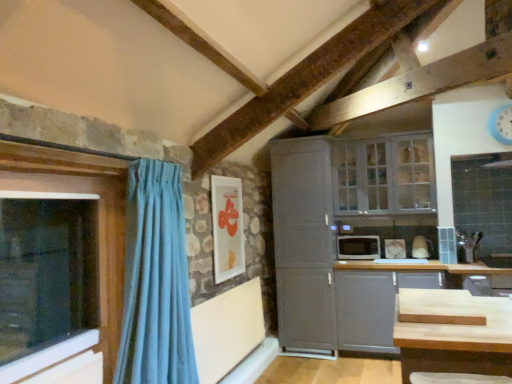
This screenshot has height=384, width=512. Identify the location of white glossy microwave at center-right. (358, 247).

The image size is (512, 384). What are the coordinates of `light blue fabric curtain at left` in the screenshot? It's located at (155, 281).

Image resolution: width=512 pixels, height=384 pixels. Describe the element at coordinates (303, 243) in the screenshot. I see `satin gray cabinet at center, positioned as the first cabinetry in left-to-right order` at that location.

Find the location of `satin gray cabinet at center, positioned as the first cabinetry in left-to-right order`. satin gray cabinet at center, positioned as the first cabinetry in left-to-right order is located at coordinates (303, 243).

This screenshot has width=512, height=384. In order to click on white glass cabinet at upper right, the second window when ordered from front to back in this screenshot , I will do `click(384, 175)`.

Is white glass cabinet at upper right, which ranks as the 1th window in right-to-left order, bigger or smaller than matte gray cabinet at lower right, which ranks as the first cabinetry in right-to-left order?

white glass cabinet at upper right, which ranks as the 1th window in right-to-left order, is smaller than matte gray cabinet at lower right, which ranks as the first cabinetry in right-to-left order.

From the image's perspective, which object appears higher, white glass cabinet at upper right, which is the 1th window from back to front, or matte gray cabinet at lower right, placed as the 2th cabinetry when sorted from left to right?

white glass cabinet at upper right, which is the 1th window from back to front, from the image's perspective.

Is white glass cabinet at upper right, arranged as the 2th window when viewed from the left, shorter than matte gray cabinet at lower right, placed as the 2th cabinetry when sorted from left to right?

Correct, white glass cabinet at upper right, arranged as the 2th window when viewed from the left, is not as tall as matte gray cabinet at lower right, placed as the 2th cabinetry when sorted from left to right.

How distant is white glass cabinet at upper right, which ranks as the 1th window in right-to-left order, from matte gray cabinet at lower right, placed as the 2th cabinetry when sorted from left to right?

white glass cabinet at upper right, which ranks as the 1th window in right-to-left order, and matte gray cabinet at lower right, placed as the 2th cabinetry when sorted from left to right, are 34.72 inches apart.

In the scene shown: Considering the sizes of objects matte gray cabinet at lower right, placed as the 2th cabinetry when sorted from left to right, and white glossy microwave at center-right in the image provided, who is bigger, matte gray cabinet at lower right, placed as the 2th cabinetry when sorted from left to right, or white glossy microwave at center-right?

matte gray cabinet at lower right, placed as the 2th cabinetry when sorted from left to right, is bigger.

Which object is closer to the camera, matte gray cabinet at lower right, placed as the 2th cabinetry when sorted from left to right, or white glossy microwave at center-right?

matte gray cabinet at lower right, placed as the 2th cabinetry when sorted from left to right, is in front.

Locate an element on the screen. This screenshot has height=384, width=512. cabinetry that is below the white glossy microwave at center-right (from the image's perspective) is located at coordinates (435, 270).

Which object is further away from the camera taking this photo, white glass cabinet at upper right, which ranks as the 1th window in right-to-left order, or satin gray cabinet at center, positioned as the second cabinetry in right-to-left order?

Positioned behind is satin gray cabinet at center, positioned as the second cabinetry in right-to-left order.

Is satin gray cabinet at center, positioned as the first cabinetry in left-to-right order, located within white glass cabinet at upper right, the second window when ordered from front to back?

No, satin gray cabinet at center, positioned as the first cabinetry in left-to-right order, is located outside of white glass cabinet at upper right, the second window when ordered from front to back.

Locate an element on the screen. This screenshot has width=512, height=384. window that appears on the right of satin gray cabinet at center, positioned as the first cabinetry in left-to-right order is located at coordinates (384, 175).

Could white glossy microwave at center-right be considered to be inside light blue fabric curtain at left?

No, white glossy microwave at center-right is not a part of light blue fabric curtain at left.

Which of these two, light blue fabric curtain at left or white glossy microwave at center-right, stands taller?

light blue fabric curtain at left is taller.

Is the surface of light blue fabric curtain at left in direct contact with white glossy microwave at center-right?

No, light blue fabric curtain at left is not making contact with white glossy microwave at center-right.

Is satin gray cabinet at center, positioned as the second cabinetry in right-to-left order, to the left of white glossy picture frame at upper center from the viewer's perspective?

No, satin gray cabinet at center, positioned as the second cabinetry in right-to-left order, is not to the left of white glossy picture frame at upper center.

Between satin gray cabinet at center, positioned as the first cabinetry in left-to-right order, and white glossy picture frame at upper center, which one has larger size?

With larger size is satin gray cabinet at center, positioned as the first cabinetry in left-to-right order.

Considering the relative sizes of satin gray cabinet at center, positioned as the first cabinetry in left-to-right order, and white glossy picture frame at upper center in the image provided, is satin gray cabinet at center, positioned as the first cabinetry in left-to-right order, shorter than white glossy picture frame at upper center?

No, satin gray cabinet at center, positioned as the first cabinetry in left-to-right order, is not shorter than white glossy picture frame at upper center.

Which is more distant, [178,294] or [368,175]?

Positioned behind is point [368,175].

Is light blue fabric curtain at left facing towards white glass cabinet at upper right, which ranks as the 1th window in right-to-left order?

No, light blue fabric curtain at left does not turn towards white glass cabinet at upper right, which ranks as the 1th window in right-to-left order.

Is light blue fabric curtain at left to the left or to the right of white glass cabinet at upper right, which is the 1th window from back to front, in the image?

→ light blue fabric curtain at left is positioned on white glass cabinet at upper right, which is the 1th window from back to front,'s left side.

Could you measure the distance between light blue fabric curtain at left and white glass cabinet at upper right, arranged as the 2th window when viewed from the left?

light blue fabric curtain at left and white glass cabinet at upper right, arranged as the 2th window when viewed from the left, are 2.48 meters apart from each other.

Does point (423, 148) come closer to viewer compared to point (233, 200)?

No.

Does white glass cabinet at upper right, the second window when ordered from front to back, turn towards white glossy picture frame at upper center?

No, white glass cabinet at upper right, the second window when ordered from front to back, is not turned towards white glossy picture frame at upper center.

Based on the photo, is white glass cabinet at upper right, arranged as the 2th window when viewed from the left, outside of white glossy picture frame at upper center?

white glass cabinet at upper right, arranged as the 2th window when viewed from the left, is positioned outside white glossy picture frame at upper center.

Between white glass cabinet at upper right, the second window when ordered from front to back, and white glossy picture frame at upper center, which one has smaller size?

Smaller between the two is white glossy picture frame at upper center.

From the image's perspective, which window is the 2nd one above the matte gray cabinet at lower right, placed as the 2th cabinetry when sorted from left to right? Please provide its 2D coordinates.

[(384, 175)]

At what (x,y) coordinates should I click in order to perform the action: click on appliance on the left of matte gray cabinet at lower right, which ranks as the first cabinetry in right-to-left order. Please return your answer as a coordinate pair (x, y). This screenshot has height=384, width=512. Looking at the image, I should click on (358, 247).

Looking at the image, which one is located further to matte gray cabinet at lower right, placed as the 2th cabinetry when sorted from left to right, transparent glass window at left, acting as the 1th window starting from the front, or white glossy picture frame at upper center?

Among the two, transparent glass window at left, acting as the 1th window starting from the front, is located further to matte gray cabinet at lower right, placed as the 2th cabinetry when sorted from left to right.

Looking at the image, which one is located closer to light blue fabric curtain at left, white glossy picture frame at upper center or matte gray cabinet at lower right, placed as the 2th cabinetry when sorted from left to right?

Based on the image, white glossy picture frame at upper center appears to be nearer to light blue fabric curtain at left.

Considering their positions, is blue plastic clock at upper right positioned closer to white glass cabinet at upper right, arranged as the 2th window when viewed from the left, than matte gray cabinet at lower right, which ranks as the first cabinetry in right-to-left order?

The object closer to white glass cabinet at upper right, arranged as the 2th window when viewed from the left, is matte gray cabinet at lower right, which ranks as the first cabinetry in right-to-left order.

Considering their positions, is white glossy picture frame at upper center positioned closer to white glossy microwave at center-right than transparent glass window at left, acting as the 1th window starting from the front?

white glossy picture frame at upper center.

From the image, which object appears to be farther from transparent glass window at left, the 2th window from the right, blue plastic clock at upper right or satin gray cabinet at center, positioned as the second cabinetry in right-to-left order?

blue plastic clock at upper right lies further to transparent glass window at left, the 2th window from the right, than the other object.

Looking at the image, which one is located further to matte gray cabinet at lower right, placed as the 2th cabinetry when sorted from left to right, white glass cabinet at upper right, which ranks as the 1th window in right-to-left order, or blue plastic clock at upper right?

blue plastic clock at upper right lies further to matte gray cabinet at lower right, placed as the 2th cabinetry when sorted from left to right, than the other object.

When comparing their distances from white glossy picture frame at upper center, does matte gray cabinet at lower right, placed as the 2th cabinetry when sorted from left to right, or white glass cabinet at upper right, which ranks as the 1th window in right-to-left order, seem further?

white glass cabinet at upper right, which ranks as the 1th window in right-to-left order, is positioned further to the anchor white glossy picture frame at upper center.

Based on their spatial positions, is white glossy microwave at center-right or white glass cabinet at upper right, arranged as the 2th window when viewed from the left, closer to white glossy picture frame at upper center?

white glass cabinet at upper right, arranged as the 2th window when viewed from the left.

Image resolution: width=512 pixels, height=384 pixels. I want to click on appliance between light blue fabric curtain at left and blue plastic clock at upper right from left to right, so click(358, 247).

Identify the location of appliance between blue plastic clock at upper right and matte gray cabinet at lower right, placed as the 2th cabinetry when sorted from left to right, in the up-down direction. This screenshot has width=512, height=384. (358, 247).

The height and width of the screenshot is (384, 512). I want to click on cabinetry located between white glossy picture frame at upper center and white glossy microwave at center-right in the left-right direction, so click(303, 243).

Find the location of a particular element. This screenshot has width=512, height=384. picture frame located between light blue fabric curtain at left and blue plastic clock at upper right in the left-right direction is located at coordinates (227, 227).